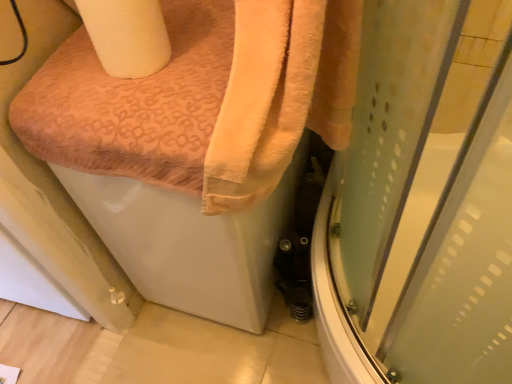
Identify the location of free location to the right of white matte toilet paper at upper left. This screenshot has height=384, width=512. (204, 44).